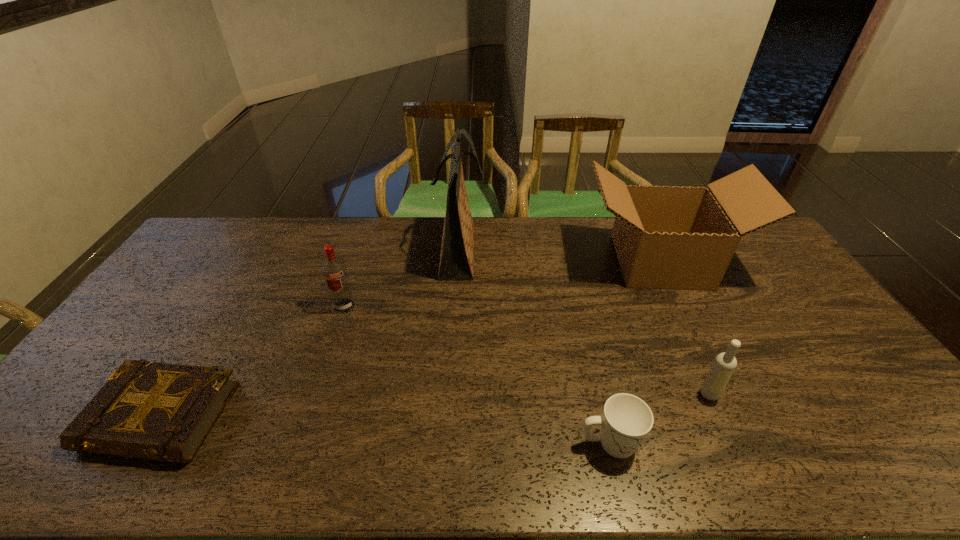
Choose which object is the nearest neighbor to the tallest object. Please provide its 2D coordinates. Your answer should be formatted as a tuple, i.e. [(x, y)], where the tuple contains the x and y coordinates of a point satisfying the conditions above.

[(334, 270)]

Locate an element on the screen. The width and height of the screenshot is (960, 540). free space that satisfies the following two spatial constraints: 1. on the front-facing side of the shopping bag; 2. on the back side of the nearer vodka is located at coordinates (451, 394).

Locate an element on the screen. The image size is (960, 540). free space that satisfies the following two spatial constraints: 1. on the front label of the third farthest object; 2. on the left side of the shorter vodka is located at coordinates (316, 394).